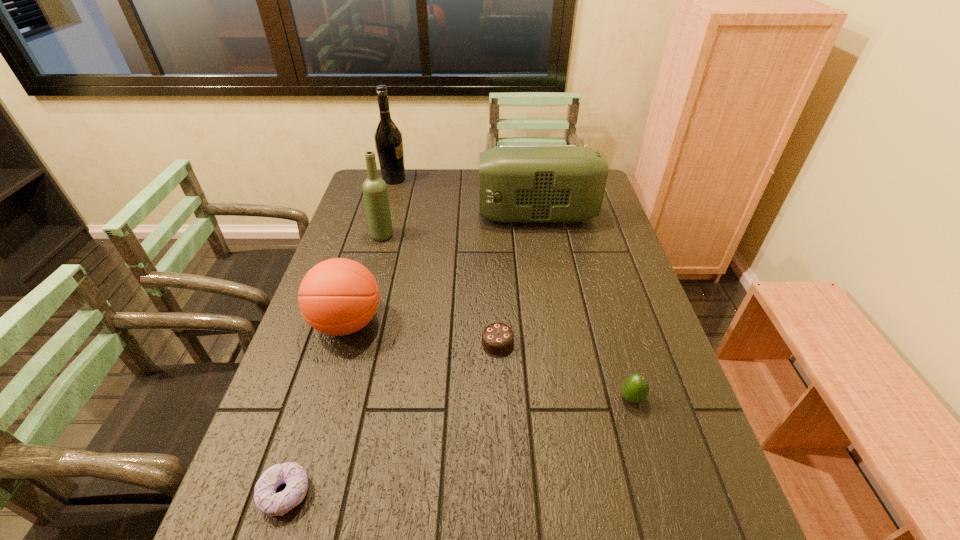
Locate an element on the screen. the tallest object is located at coordinates (388, 138).

The width and height of the screenshot is (960, 540). Identify the location of the farther wine bottle. (388, 138).

Image resolution: width=960 pixels, height=540 pixels. Find the location of `the nearer wine bottle`. the nearer wine bottle is located at coordinates (374, 188).

Identify the location of the second tallest object. (374, 188).

Find the location of a particular element. the third tallest object is located at coordinates (517, 183).

Identify the location of basketball. (339, 296).

The width and height of the screenshot is (960, 540). Identify the location of the fifth tallest object. (634, 388).

This screenshot has width=960, height=540. I want to click on avocado, so click(x=634, y=388).

This screenshot has width=960, height=540. I want to click on the second shortest object, so click(497, 338).

I want to click on doughnut, so [266, 499].